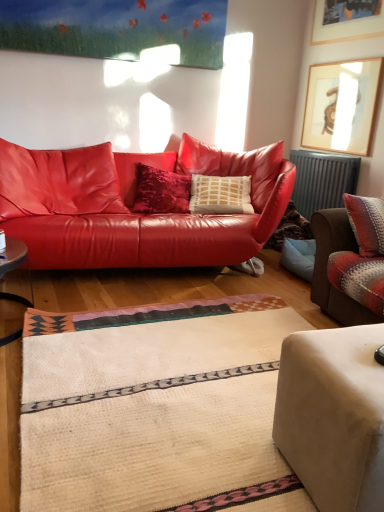
Question: In terms of width, does wooden framed artwork at upper right, the first picture frame when ordered from bottom to top, look wider or thinner when compared to velvet brown armchair at right, placed as the second studio couch when sorted from back to front?

Choices:
 (A) thin
 (B) wide

Answer: (A)

Question: In the image, is wooden framed artwork at upper right, which is counted as the second picture frame, starting from the top, positioned in front of or behind velvet brown armchair at right, the second studio couch from the front?

Choices:
 (A) behind
 (B) front

Answer: (A)

Question: Which of these objects is positioned closest to the wooden picture frame at upper right, the 1th picture frame from the top?

Choices:
 (A) wooden framed artwork at upper right, which is counted as the second picture frame, starting from the top
 (B) matte leather couch at center, which ranks as the first studio couch in back-to-front order
 (C) velvet brown armchair at right, placed as the second studio couch when sorted from back to front
 (D) beige fabric ottoman at lower right, acting as the 3th studio couch starting from the back
 (E) metallic gray radiator at right

Answer: (A)

Question: Estimate the real-world distances between objects in this image. Which object is closer to the wooden framed artwork at upper right, the first picture frame when ordered from bottom to top?

Choices:
 (A) beige fabric ottoman at lower right, the first studio couch when ordered from front to back
 (B) metallic gray radiator at right
 (C) wooden picture frame at upper right, the 1th picture frame from the top
 (D) velvet brown armchair at right, placed as the second studio couch when sorted from back to front
 (E) matte leather couch at center, acting as the 3th studio couch starting from the front

Answer: (B)